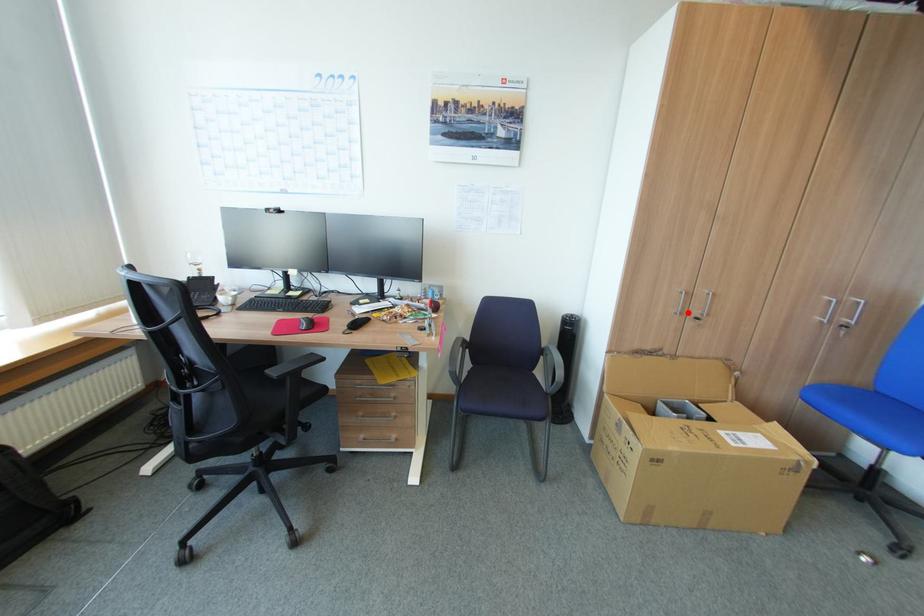
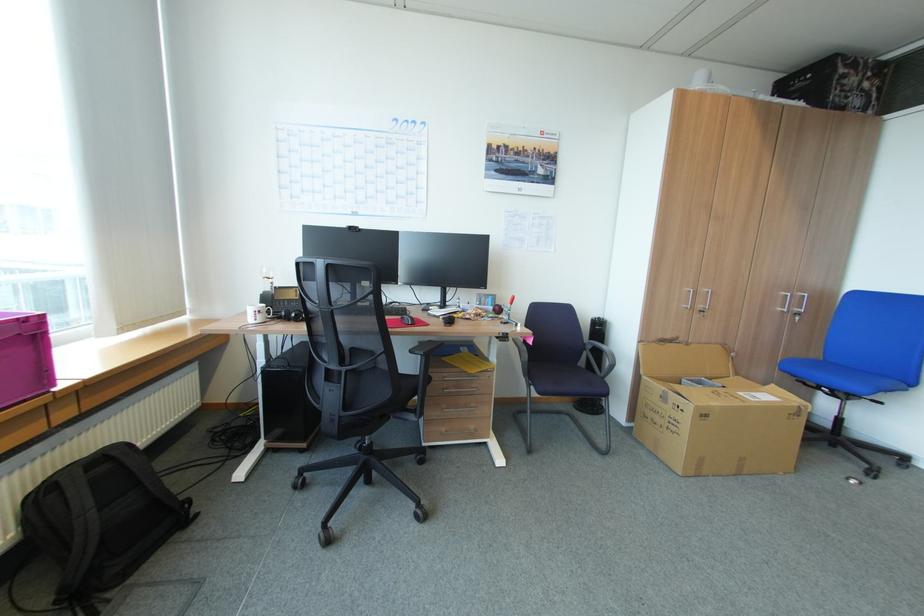
In the second image, find the point that corresponds to the highlighted location in the first image.

(698, 307)